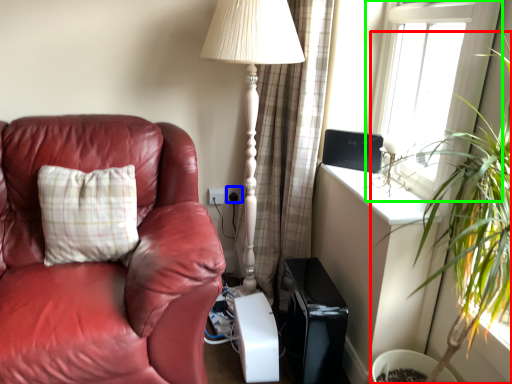
Question: Which object is the closest to the houseplant (highlighted by a red box)? Choose among these: electric outlet (highlighted by a blue box) or window (highlighted by a green box).

Choices:
 (A) electric outlet
 (B) window

Answer: (B)